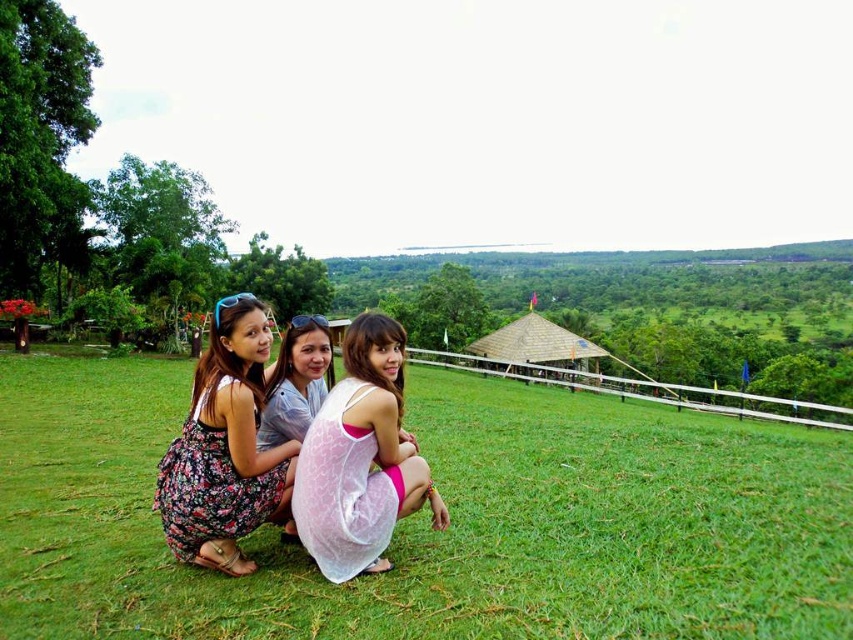
You are standing at the origin point in the image. Which object is located at the coordinates point (360, 458)?

The white lace dress at center is located at the coordinates point (360, 458).

You are planning to place a small picnic basket between the green grass at center and the floral fabric dress at lower left. Which object has a wider area to place the basket?

The green grass at center has a wider area than the floral fabric dress at lower left, so the basket can be placed there.

You are standing in the park and see the green grass at center and the floral fabric dress at lower left. Which object is positioned to the left of the other?

The green grass at center is to the left of the floral fabric dress at lower left.